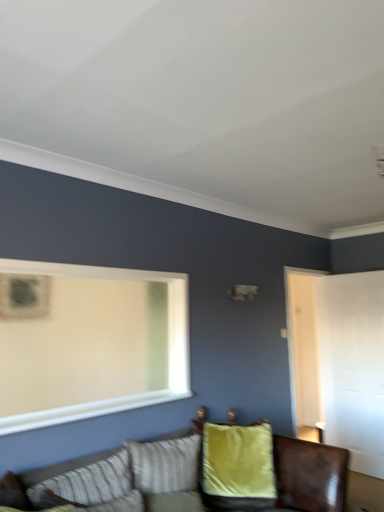
Question: Is striped fabric pillow at lower left, which is the second pillow in right-to-left order, in front of or behind velvet green couch at lower center in the image?

Choices:
 (A) front
 (B) behind

Answer: (B)

Question: Looking at the image, does striped fabric pillow at lower left, acting as the 1th pillow starting from the left, seem bigger or smaller compared to velvet green couch at lower center?

Choices:
 (A) small
 (B) big

Answer: (A)

Question: Which of these objects is positioned farthest from the velvet yellow pillow at center, which is counted as the second pillow, starting from the front?

Choices:
 (A) striped fabric pillow at lower left, which is counted as the 1th pillow, starting from the front
 (B) velvet green couch at lower center

Answer: (A)

Question: Estimate the real-world distances between objects in this image. Which object is closer to the velvet green couch at lower center?

Choices:
 (A) striped fabric pillow at lower left, acting as the 1th pillow starting from the left
 (B) velvet yellow pillow at center, which is counted as the 2th pillow, starting from the left

Answer: (B)